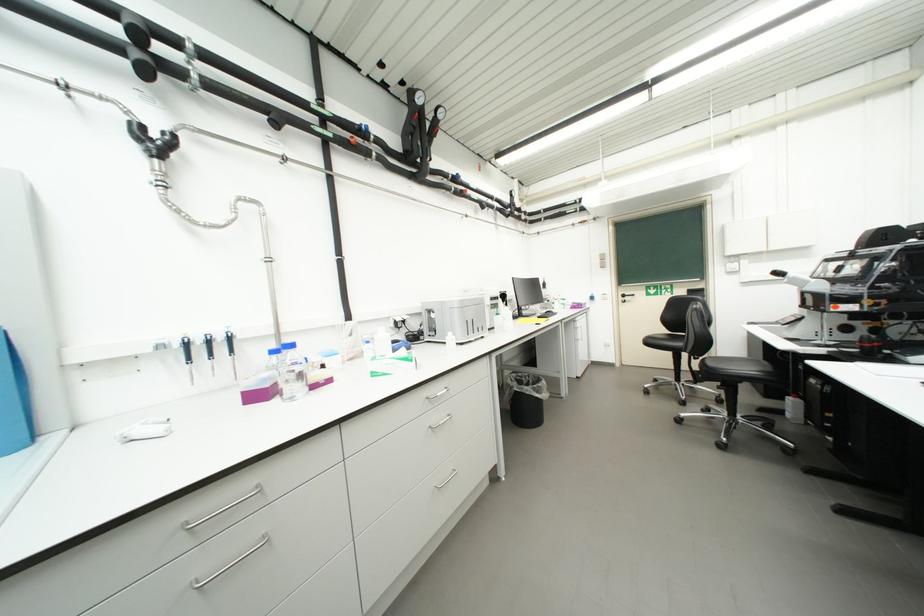
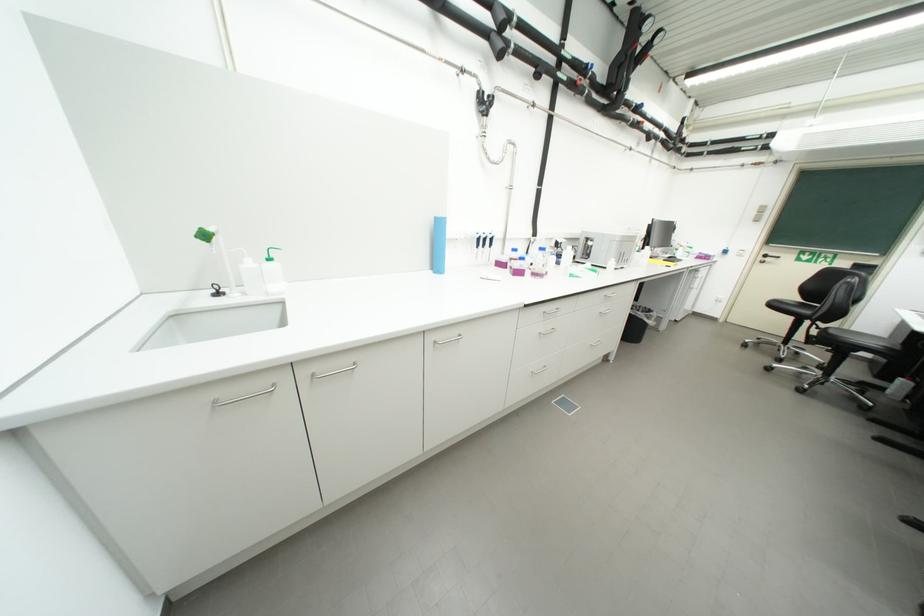
Find the pixel in the second image that matches (536,391) in the first image.

(649, 317)